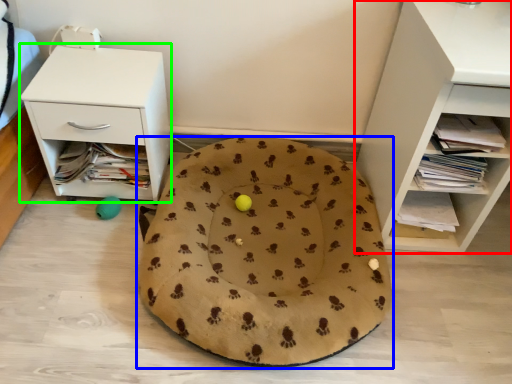
Question: Which is farther away from shelf (highlighted by a red box)? dog bed (highlighted by a blue box) or nightstand (highlighted by a green box)?

Choices:
 (A) dog bed
 (B) nightstand

Answer: (B)